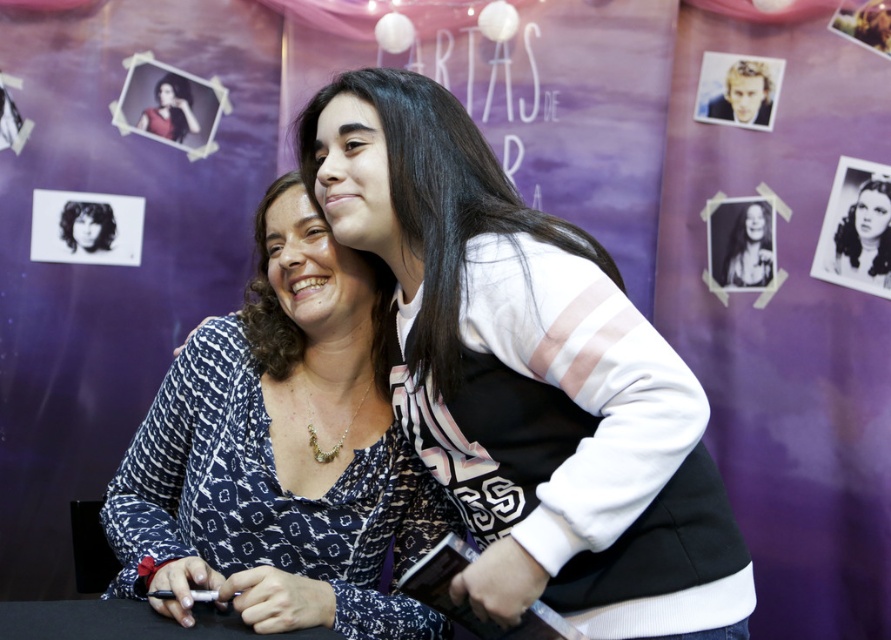
Is the position of patterned fabric blouse at center less distant than that of black glossy photo at upper right?

Yes, patterned fabric blouse at center is in front of black glossy photo at upper right.

Is point (323, 480) positioned before point (887, 196)?

Yes, point (323, 480) is in front of point (887, 196).

At what (x,y) coordinates should I click in order to perform the action: click on patterned fabric blouse at center. Please return your answer as a coordinate pair (x, y). Looking at the image, I should click on (282, 451).

Who is shorter, patterned fabric blouse at center or black glossy photo at center?

black glossy photo at center is shorter.

Between point (295, 243) and point (764, 250), which one is positioned in front?

Positioned in front is point (295, 243).

The height and width of the screenshot is (640, 891). What are the coordinates of `patterned fabric blouse at center` in the screenshot? It's located at (282, 451).

Is white matte sweater at center bigger than black glossy photo at center?

Indeed, white matte sweater at center has a larger size compared to black glossy photo at center.

The width and height of the screenshot is (891, 640). I want to click on white matte sweater at center, so click(x=528, y=378).